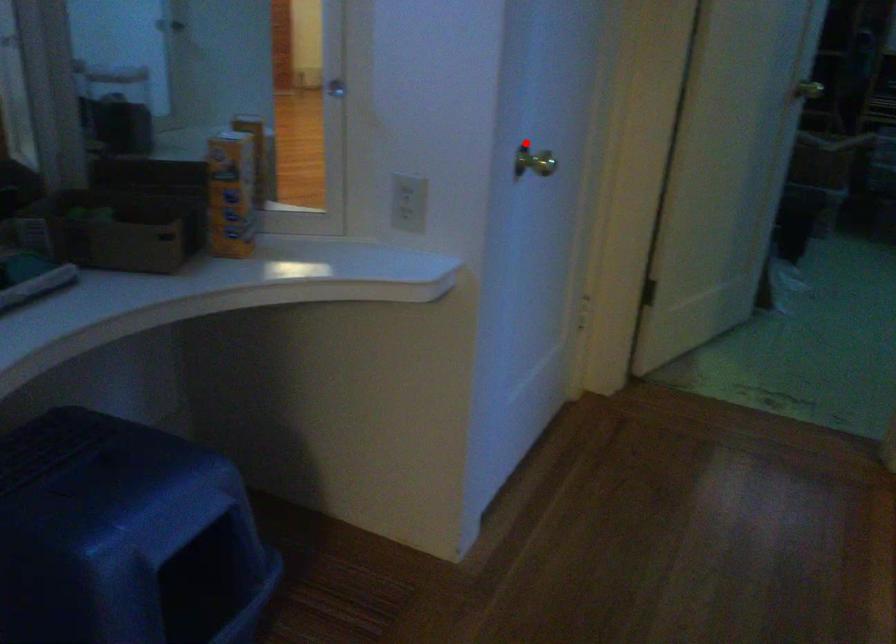
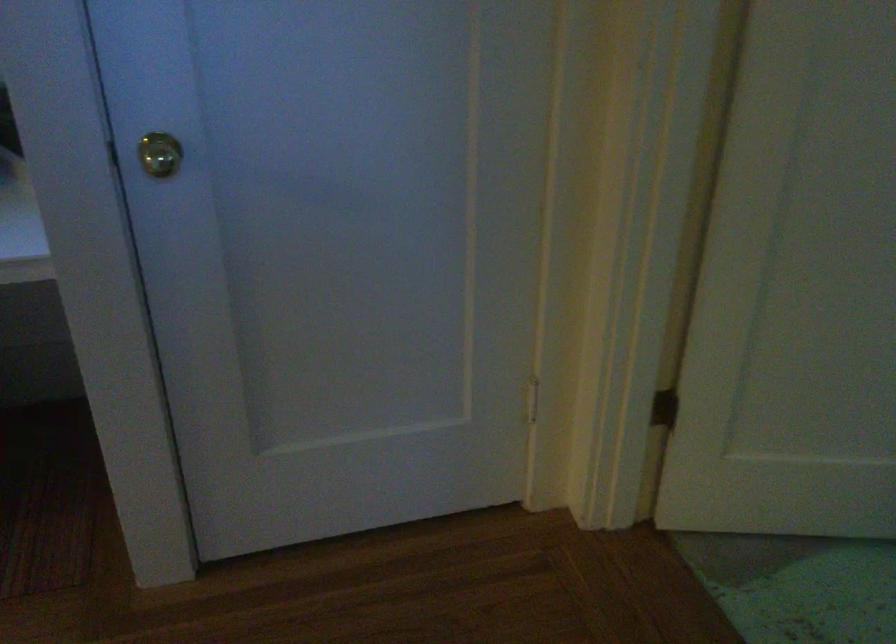
The point at the highlighted location is marked in the first image. Where is the corresponding point in the second image?

(159, 154)